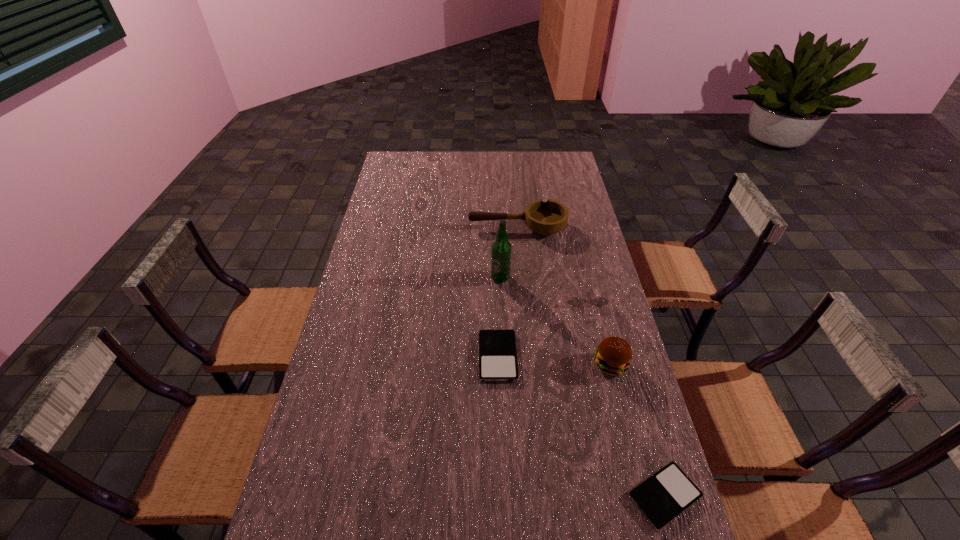
In the image, there is a desktop. Identify the location of free space at the far right corner. This screenshot has width=960, height=540. (554, 167).

In the image, there is a desktop. Identify the location of vacant space at the near right corner. Image resolution: width=960 pixels, height=540 pixels. (678, 536).

Where is `vacant space that is in between the right iPod and the sunglasses`? This screenshot has height=540, width=960. vacant space that is in between the right iPod and the sunglasses is located at coordinates (625, 395).

Where is `vacant area between the fifth shortest object and the third farthest object`? The height and width of the screenshot is (540, 960). vacant area between the fifth shortest object and the third farthest object is located at coordinates (597, 330).

The height and width of the screenshot is (540, 960). I want to click on empty space that is in between the nearest object and the farther iPod, so click(x=581, y=426).

Image resolution: width=960 pixels, height=540 pixels. Identify the location of empty space that is in between the tallest object and the shorter iPod. (583, 387).

Where is `free spot between the fourth shortest object and the sunglasses`? free spot between the fourth shortest object and the sunglasses is located at coordinates (551, 261).

Where is `unoccupied area between the saucepan and the nearest object`? This screenshot has width=960, height=540. unoccupied area between the saucepan and the nearest object is located at coordinates (590, 362).

The width and height of the screenshot is (960, 540). Find the location of `vacant area that lies between the shorter iPod and the hamburger`. vacant area that lies between the shorter iPod and the hamburger is located at coordinates (637, 430).

Find the location of a particular element. This screenshot has height=540, width=960. free point between the fifth shortest object and the nearer iPod is located at coordinates (637, 430).